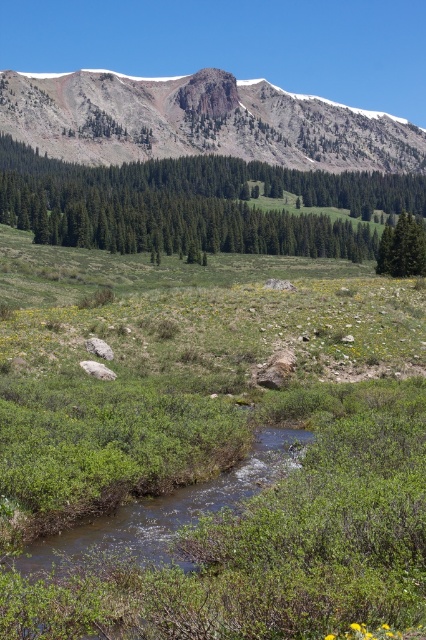
You are planning to set up a tent in this mountainous area. You need to choose between the area near the green textured tree at center or the base of the rusty rock mountain at upper center. Which location offers more space for your tent due to the terrain width?

The green textured tree at center is thinner than the rusty rock mountain at upper center, so the area near the green textured tree at center offers more space for your tent because it occupies less width compared to the mountain.

You are a hiker planning to take a photo of the rusty rock mountain at upper center and the green matte tree at right from a viewpoint. Which object will appear larger in the photo?

The rusty rock mountain at upper center will appear larger in the photo because it is positioned over the green matte tree at right, indicating it is closer to the camera and therefore larger in the frame.

You are a hiker standing at the edge of the meadow looking towards the mountains. Which object, the rusty rock mountain at upper center or the green matte tree at right, would appear closer to you?

The rusty rock mountain at upper center appears closer to you because it is positioned further to the viewer than the green matte tree at right, meaning it overlaps and is nearer in the visual field.